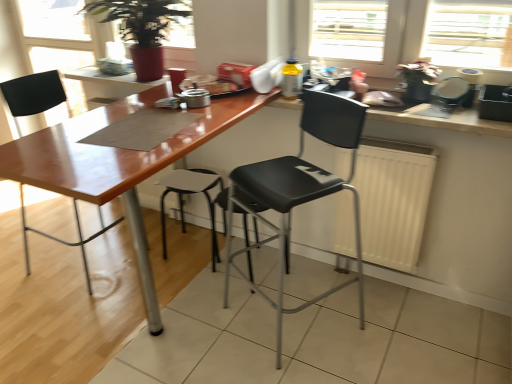
At what (x,y) coordinates should I click in order to perform the action: click on blank space to the left of matte black stool at center. Please return your answer as a coordinate pair (x, y). This screenshot has height=384, width=512. Looking at the image, I should click on (148, 252).